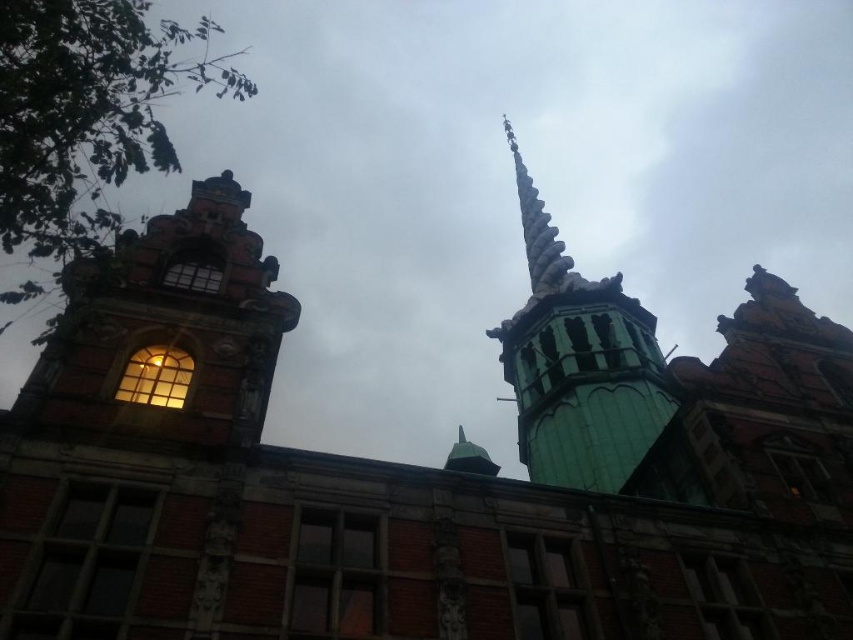
Question: Which is nearer to the cloudy sky at upper center?

Choices:
 (A) gray stone spire at upper center
 (B) green glazed tile spire at upper center

Answer: (B)

Question: Can you confirm if green glazed tile spire at upper center is wider than gray stone spire at upper center?

Choices:
 (A) no
 (B) yes

Answer: (B)

Question: Is cloudy sky at upper center thinner than gray stone spire at upper center?

Choices:
 (A) no
 (B) yes

Answer: (A)

Question: Can you confirm if cloudy sky at upper center is positioned below gray stone spire at upper center?

Choices:
 (A) yes
 (B) no

Answer: (B)

Question: Among these objects, which one is nearest to the camera?

Choices:
 (A) green glazed tile spire at upper center
 (B) cloudy sky at upper center
 (C) gray stone spire at upper center

Answer: (B)

Question: Among these points, which one is farthest from the camera?

Choices:
 (A) (514, 358)
 (B) (548, 195)

Answer: (B)